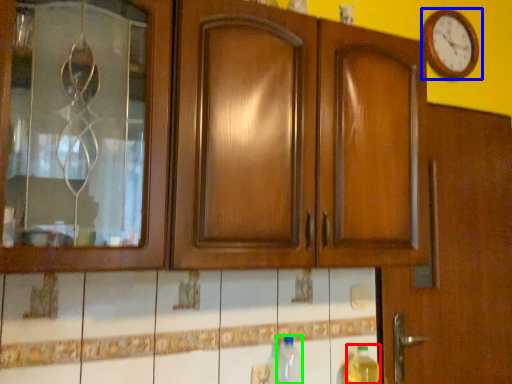
Question: Which object is the closest to the bottle (highlighted by a red box)? Choose among these: wall clock (highlighted by a blue box) or bottle (highlighted by a green box).

Choices:
 (A) wall clock
 (B) bottle

Answer: (B)